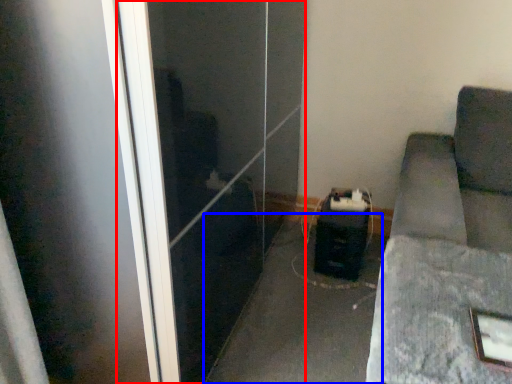
Question: Which object is further to the camera taking this photo, screen door (highlighted by a red box) or concrete (highlighted by a blue box)?

Choices:
 (A) screen door
 (B) concrete

Answer: (B)